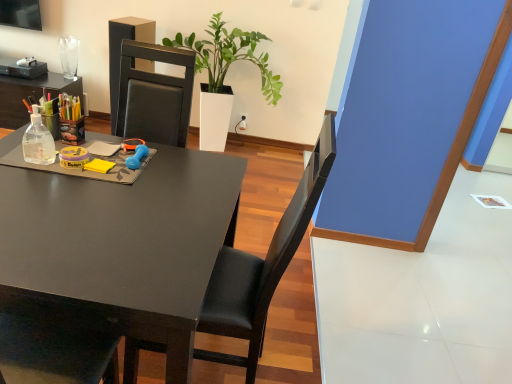
Question: From a real-world perspective, is white glossy planter at center on top of matte black desk at center?

Choices:
 (A) yes
 (B) no

Answer: (A)

Question: Is white glossy planter at center to the left of matte black desk at center from the viewer's perspective?

Choices:
 (A) no
 (B) yes

Answer: (A)

Question: Is white glossy planter at center positioned with its back to matte black desk at center?

Choices:
 (A) no
 (B) yes

Answer: (A)

Question: Are white glossy planter at center and matte black desk at center far apart?

Choices:
 (A) no
 (B) yes

Answer: (B)

Question: Considering the relative sizes of white glossy planter at center and matte black desk at center in the image provided, is white glossy planter at center smaller than matte black desk at center?

Choices:
 (A) yes
 (B) no

Answer: (B)

Question: Is point (225, 49) closer or farther from the camera than point (322, 150)?

Choices:
 (A) closer
 (B) farther

Answer: (B)

Question: Is white glossy planter at center situated inside black leather chair at center or outside?

Choices:
 (A) inside
 (B) outside

Answer: (B)

Question: Is white glossy planter at center taller or shorter than black leather chair at center?

Choices:
 (A) short
 (B) tall

Answer: (A)

Question: Is white glossy planter at center wider or thinner than black leather chair at center?

Choices:
 (A) wide
 (B) thin

Answer: (A)

Question: Looking at the image, does white glossy planter at center seem bigger or smaller compared to matte black desk at center?

Choices:
 (A) big
 (B) small

Answer: (A)

Question: In terms of width, does white glossy planter at center look wider or thinner when compared to matte black desk at center?

Choices:
 (A) wide
 (B) thin

Answer: (B)

Question: Considering the relative positions of white glossy planter at center and matte black desk at center in the image provided, is white glossy planter at center to the left or to the right of matte black desk at center?

Choices:
 (A) left
 (B) right

Answer: (B)

Question: Considering the positions of white glossy planter at center and matte black desk at center in the image, is white glossy planter at center taller or shorter than matte black desk at center?

Choices:
 (A) short
 (B) tall

Answer: (B)

Question: Based on their sizes in the image, would you say black leather chair at center is bigger or smaller than white glossy planter at center?

Choices:
 (A) small
 (B) big

Answer: (A)

Question: Relative to white glossy planter at center, is black leather chair at center in front or behind?

Choices:
 (A) front
 (B) behind

Answer: (A)